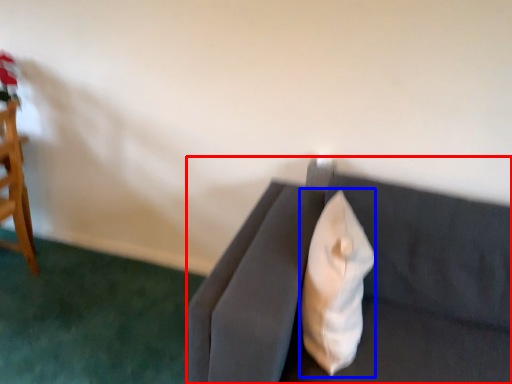
Question: Which object appears farthest to the camera in this image, studio couch (highlighted by a red box) or throw pillow (highlighted by a blue box)?

Choices:
 (A) studio couch
 (B) throw pillow

Answer: (B)